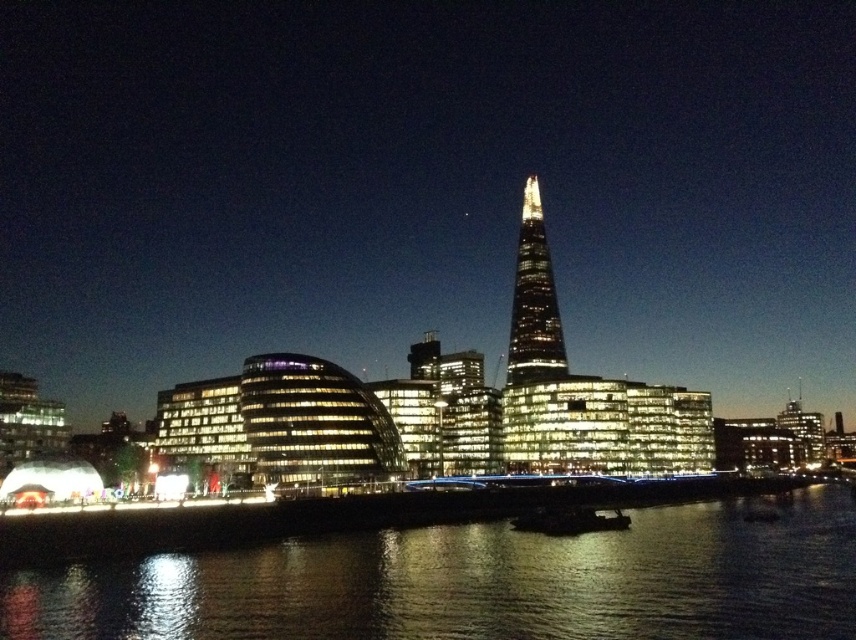
You are standing at the viewpoint where the image was taken. There are two points marked in the scene. The first point is at coordinates point (167, 589) and the second is at point (519, 362). Which point is closer to you?

Point (167, 589) is closer to you because it is in front of point (519, 362).